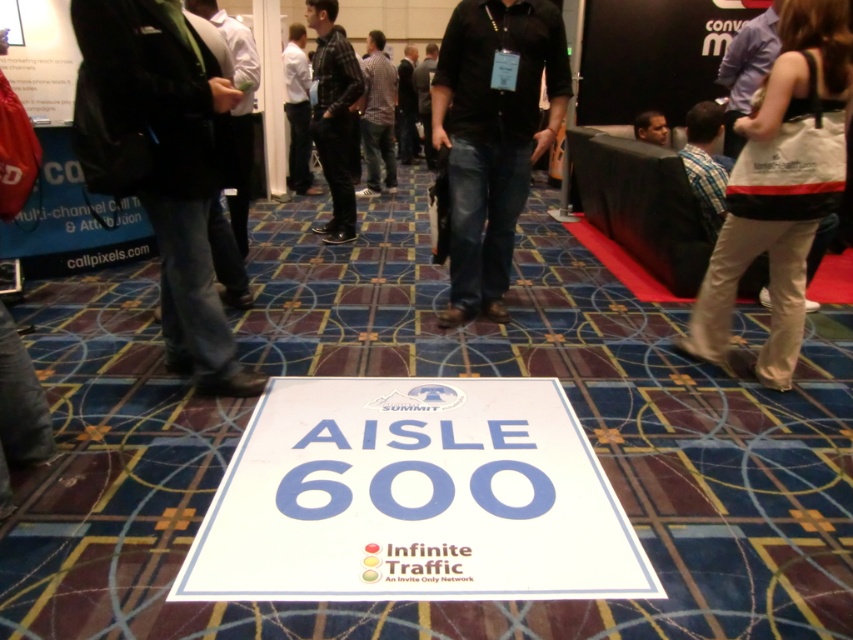
You are standing at the entrance of the conference hall and see both the white paper sign at center and the black leather jacket at center. If you want to reach the sign first, which direction should you move towards?

Since the white paper sign at center is 9.81 feet away from the black leather jacket at center, you should move towards the direction of the white paper sign at center to reach it first.

You are standing in the conference hall and need to find the white paper sign at center. According to the scene description, where should you look to find it?

The white paper sign at center is located at point (415, 499) in the scene.